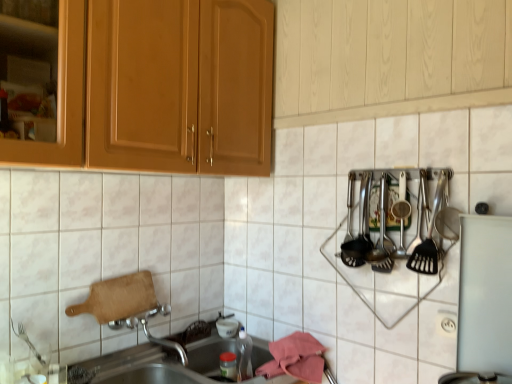
Question: From the image's perspective, does white plastic electric outlet at lower right appear lower than polished stainless steel utensils at right, acting as the 1th silverware starting from the left?

Choices:
 (A) no
 (B) yes

Answer: (B)

Question: Can you confirm if white plastic electric outlet at lower right is wider than polished stainless steel utensils at right, which is counted as the 2th silverware, starting from the front?

Choices:
 (A) no
 (B) yes

Answer: (A)

Question: Is white plastic electric outlet at lower right with polished stainless steel utensils at right, which appears as the second silverware when viewed from the right?

Choices:
 (A) no
 (B) yes

Answer: (A)

Question: From a real-world perspective, is white plastic electric outlet at lower right physically below polished stainless steel utensils at right, which appears as the 1th silverware when viewed from the back?

Choices:
 (A) yes
 (B) no

Answer: (A)

Question: Considering the relative positions of white plastic electric outlet at lower right and polished stainless steel utensils at right, which appears as the 1th silverware when viewed from the back, in the image provided, is white plastic electric outlet at lower right to the left of polished stainless steel utensils at right, which appears as the 1th silverware when viewed from the back, from the viewer's perspective?

Choices:
 (A) no
 (B) yes

Answer: (A)

Question: In terms of width, does white plastic electric outlet at lower right look wider or thinner when compared to white glossy tile at upper center?

Choices:
 (A) wide
 (B) thin

Answer: (B)

Question: From a real-world perspective, is white plastic electric outlet at lower right positioned above or below white glossy tile at upper center?

Choices:
 (A) below
 (B) above

Answer: (A)

Question: From the image's perspective, is white plastic electric outlet at lower right above or below white glossy tile at upper center?

Choices:
 (A) above
 (B) below

Answer: (B)

Question: Do you think white plastic electric outlet at lower right is within white glossy tile at upper center, or outside of it?

Choices:
 (A) outside
 (B) inside

Answer: (B)

Question: In terms of height, does polished stainless steel utensils at right, which is counted as the 2th silverware, starting from the front, look taller or shorter compared to white glossy tile at upper center?

Choices:
 (A) short
 (B) tall

Answer: (A)

Question: Is point (364, 215) positioned closer to the camera than point (352, 269)?

Choices:
 (A) closer
 (B) farther

Answer: (A)

Question: Relative to white glossy tile at upper center, is polished stainless steel utensils at right, which is counted as the 2th silverware, starting from the front, in front or behind?

Choices:
 (A) behind
 (B) front

Answer: (A)

Question: In terms of size, does polished stainless steel utensils at right, acting as the 1th silverware starting from the left, appear bigger or smaller than white glossy tile at upper center?

Choices:
 (A) small
 (B) big

Answer: (A)

Question: Is point (442, 309) closer or farther from the camera than point (128, 377)?

Choices:
 (A) closer
 (B) farther

Answer: (A)

Question: From the image's perspective, relative to metallic stainless steel sink at lower left, is white plastic electric outlet at lower right above or below?

Choices:
 (A) below
 (B) above

Answer: (B)